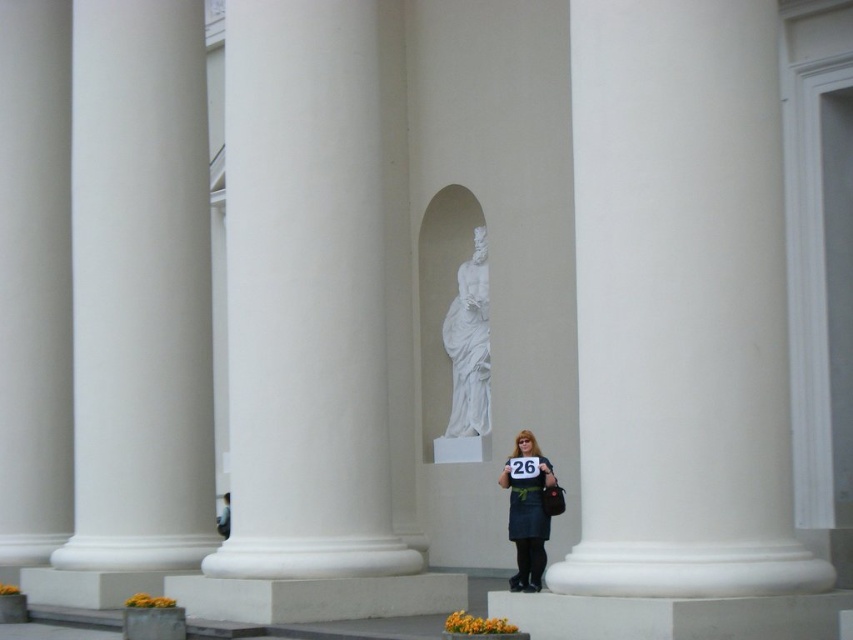
You are standing in front of the classical columns and the statue niche. You notice two points marked in the scene. The first point is at coordinates point (642, 353) and the second is at point (466, 436). Which of these points is nearer to you?

Point (642, 353) is closer to the viewer than point (466, 436).

You are standing in front of the classical structure and notice a point marked at coordinates (x=682, y=305). Which object does this point correspond to?

The point at coordinates (x=682, y=305) corresponds to the white smooth pillar at right.

You are standing in front of the classical structure and want to take a photo of the white smooth column at center. The camera you have can focus on objects up to 100 feet away. Will the column be in focus?

The white smooth column at center is 111.01 feet from the viewer, which is beyond the camera focus range of 100 feet. Therefore, the column will not be in focus.